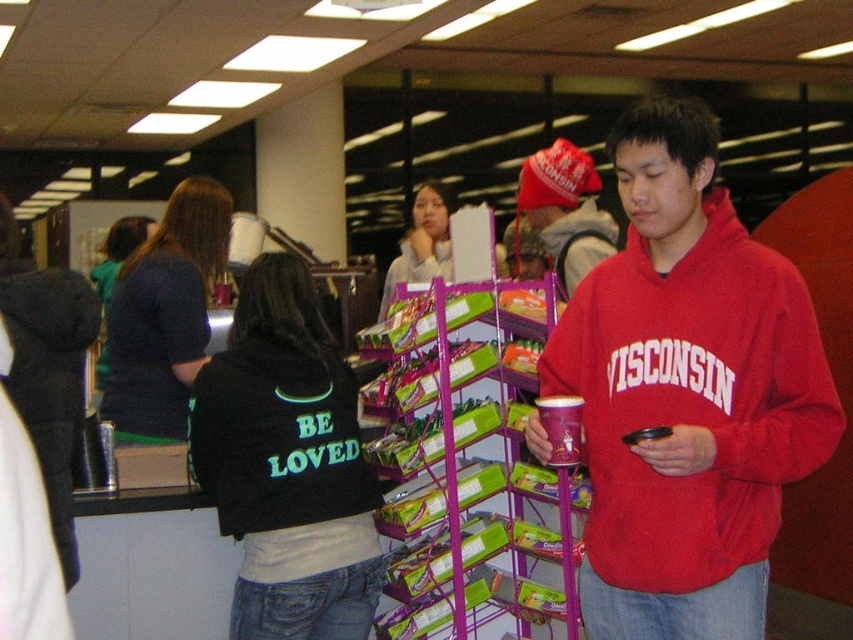
Question: Is red matte sweatshirt at center above black fleece jacket at center?

Choices:
 (A) yes
 (B) no

Answer: (A)

Question: Does dark blue sweater at center appear under matte red beanie at upper center?

Choices:
 (A) no
 (B) yes

Answer: (B)

Question: Which of the following is the farthest from the observer?

Choices:
 (A) red matte sweatshirt at center
 (B) matte red beanie at upper center
 (C) dark blue sweater at center
 (D) purple plastic shelf at center

Answer: (C)

Question: Considering the real-world distances, which object is closest to the matte red beanie at upper center?

Choices:
 (A) purple plastic shelf at center
 (B) dark blue sweater at center
 (C) red matte sweatshirt at center
 (D) black fleece jacket at center

Answer: (A)

Question: Estimate the real-world distances between objects in this image. Which object is closer to the red matte sweatshirt at center?

Choices:
 (A) black fleece jacket at center
 (B) dark blue sweater at center
 (C) purple plastic shelf at center

Answer: (C)

Question: Does red matte sweatshirt at center lie behind matte red beanie at upper center?

Choices:
 (A) no
 (B) yes

Answer: (A)